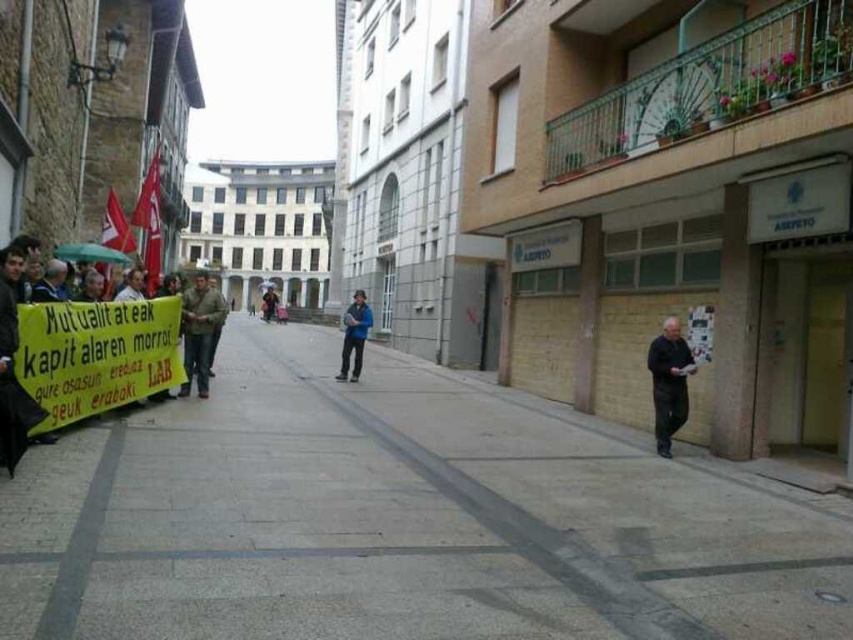
You are a pedestrian standing on the street. You see a black matte jacket at lower right and a camouflage fabric jacket at center. Which jacket is nearer to you?

The black matte jacket at lower right is closer to the viewer than the camouflage fabric jacket at center.

Consider the image. You are a delivery person standing on the gray concrete pavement at center and need to move to the black matte jacket at lower right. Is the path between them clear enough for a delivery cart?

The gray concrete pavement at center might be wider than black matte jacket at lower right, so the path between them may be clear enough for a delivery cart to pass through.